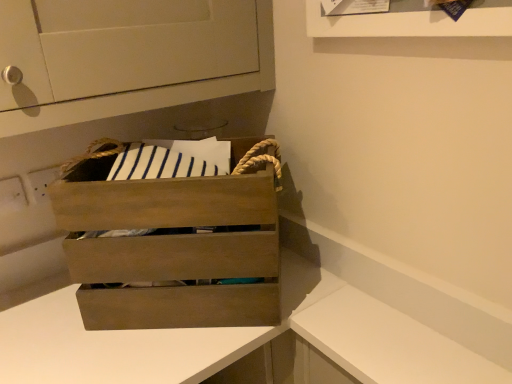
Question: From the image's perspective, is wooden crate at center under white matte counter at lower right, placed as the 2th counter when sorted from left to right?

Choices:
 (A) yes
 (B) no

Answer: (B)

Question: Considering the relative positions of wooden crate at center and white matte counter at lower right, placed as the 2th counter when sorted from left to right, in the image provided, is wooden crate at center to the right of white matte counter at lower right, placed as the 2th counter when sorted from left to right, from the viewer's perspective?

Choices:
 (A) yes
 (B) no

Answer: (B)

Question: Considering the relative positions of wooden crate at center and white matte counter at lower right, placed as the first counter when sorted from right to left, in the image provided, is wooden crate at center to the left of white matte counter at lower right, placed as the first counter when sorted from right to left, from the viewer's perspective?

Choices:
 (A) no
 (B) yes

Answer: (B)

Question: Is wooden crate at center smaller than white matte counter at lower right, placed as the 2th counter when sorted from left to right?

Choices:
 (A) no
 (B) yes

Answer: (B)

Question: Can you confirm if wooden crate at center is bigger than white matte counter at lower right, placed as the first counter when sorted from right to left?

Choices:
 (A) no
 (B) yes

Answer: (A)

Question: Is wooden crate at center, the 1th counter in the left-to-right sequence, to the left or to the right of white matte counter at lower right, placed as the first counter when sorted from right to left, in the image?

Choices:
 (A) left
 (B) right

Answer: (A)

Question: Do you think wooden crate at center, the 1th counter in the left-to-right sequence, is within white matte counter at lower right, placed as the 2th counter when sorted from left to right, or outside of it?

Choices:
 (A) inside
 (B) outside

Answer: (B)

Question: From a real-world perspective, relative to white matte counter at lower right, placed as the first counter when sorted from right to left, is wooden crate at center, the 1th counter in the left-to-right sequence, vertically above or below?

Choices:
 (A) above
 (B) below

Answer: (B)

Question: In the image, is wooden crate at center, which is the 2th counter in right-to-left order, positioned in front of or behind white matte counter at lower right, placed as the 2th counter when sorted from left to right?

Choices:
 (A) front
 (B) behind

Answer: (B)

Question: In terms of size, does white matte counter at lower right, placed as the 2th counter when sorted from left to right, appear bigger or smaller than wooden crate at center, the 1th counter in the left-to-right sequence?

Choices:
 (A) small
 (B) big

Answer: (A)

Question: In terms of height, does white matte counter at lower right, placed as the 2th counter when sorted from left to right, look taller or shorter compared to wooden crate at center, the 1th counter in the left-to-right sequence?

Choices:
 (A) short
 (B) tall

Answer: (A)

Question: In the image, is white matte counter at lower right, placed as the first counter when sorted from right to left, on the left side or the right side of wooden crate at center, which is the 2th counter in right-to-left order?

Choices:
 (A) left
 (B) right

Answer: (B)

Question: From the image's perspective, is white matte counter at lower right, placed as the first counter when sorted from right to left, positioned above or below wooden crate at center, which is the 2th counter in right-to-left order?

Choices:
 (A) above
 (B) below

Answer: (A)

Question: Is point (265, 158) positioned closer to the camera than point (357, 251)?

Choices:
 (A) closer
 (B) farther

Answer: (B)

Question: Considering the positions of wooden crate at center and white matte counter at lower right, placed as the first counter when sorted from right to left, in the image, is wooden crate at center bigger or smaller than white matte counter at lower right, placed as the first counter when sorted from right to left,?

Choices:
 (A) big
 (B) small

Answer: (B)